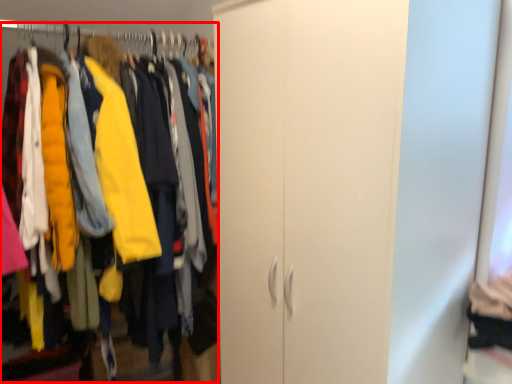
Question: In this image, where is closet (annotated by the red box) located relative to hanger?

Choices:
 (A) right
 (B) left

Answer: (A)